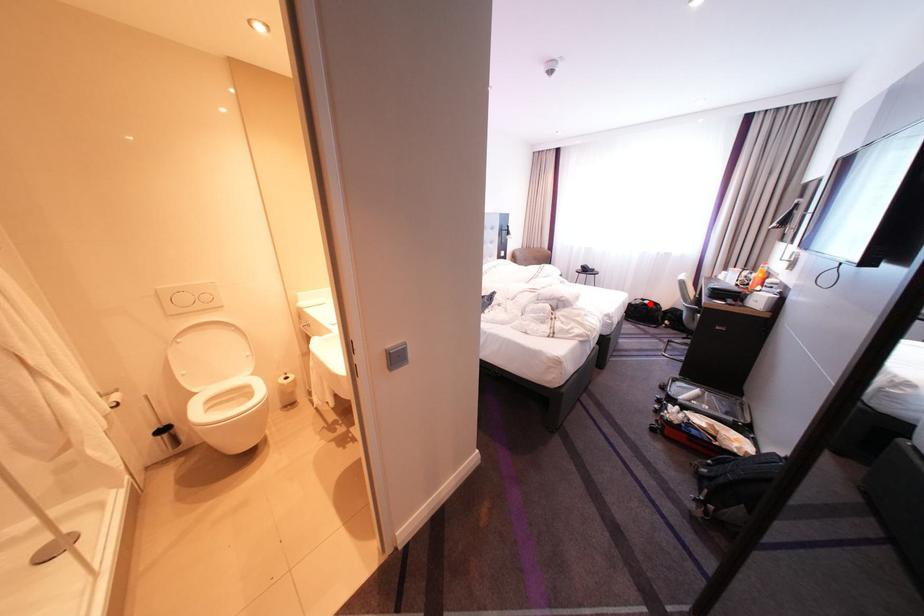
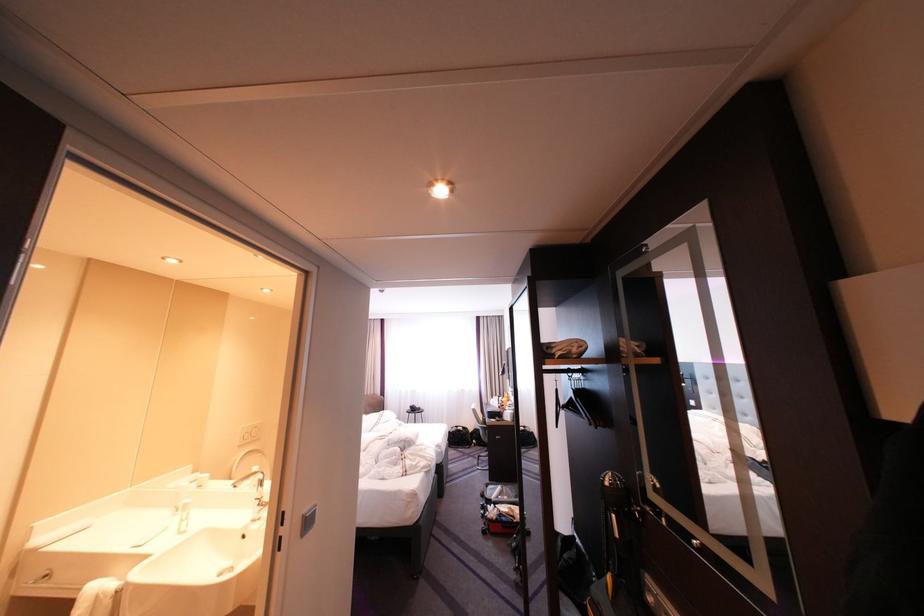
Question: A red point is marked in image1. In image2, is the corresponding 3D point closer to the camera or farther? Reply with the corresponding letter.

Choices:
 (A) The corresponding 3D point is closer.
 (B) The corresponding 3D point is farther.

Answer: (B)